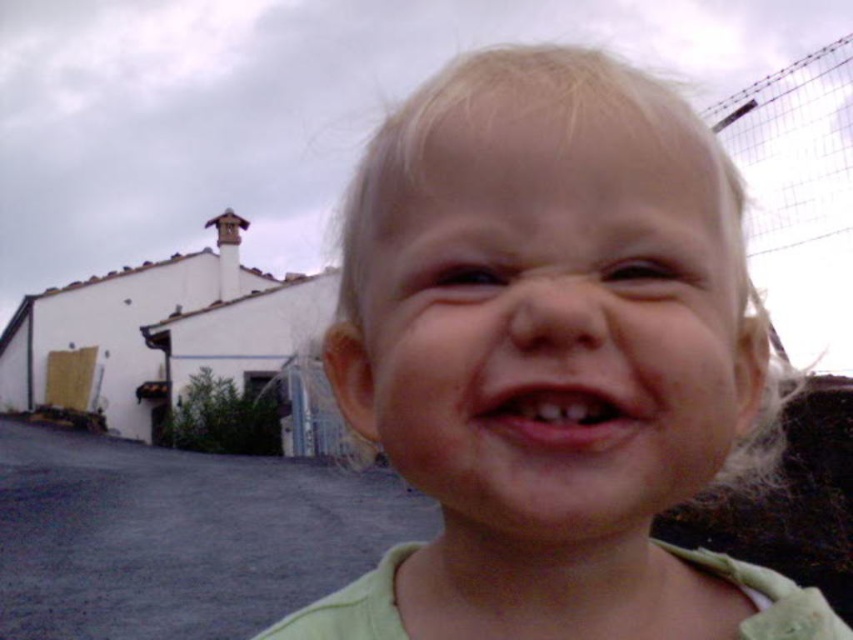
Looking at this image, what are the coordinates of the light blonde hair at center?

The light blonde hair at center is located at point (552,356).

The image shows a young child with light blonde hair and a white building with a sloped roof. There is a fence on the right and an overcast sky. A point at coordinates (552, 356) is visible. Where exactly is this point located in relation to the child?

The point at coordinates (552, 356) is located on the light blonde hair at the center of the child.

The child has light blonde hair at center and pink flesh at center. Which part of the child is taller?

The light blonde hair at center is taller than the pink flesh at center.